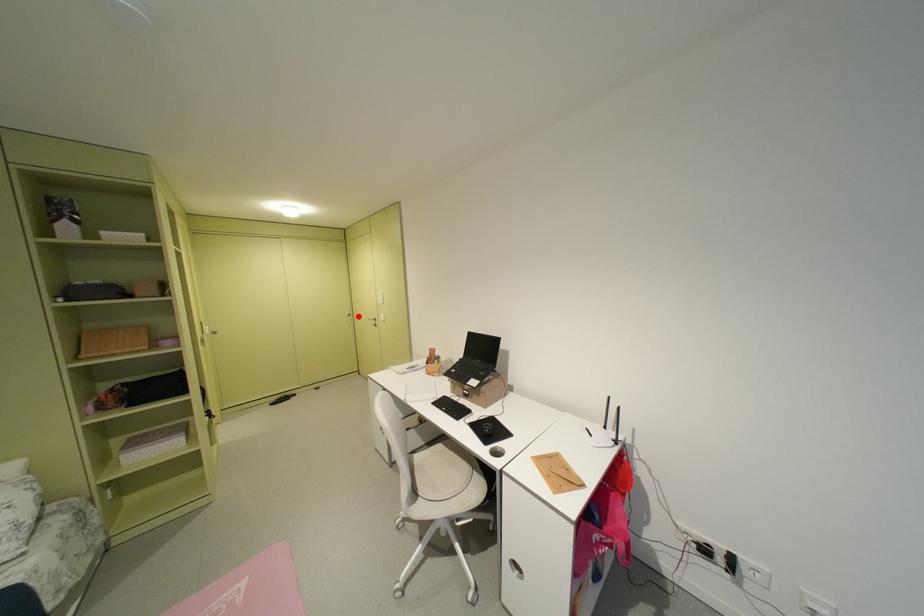
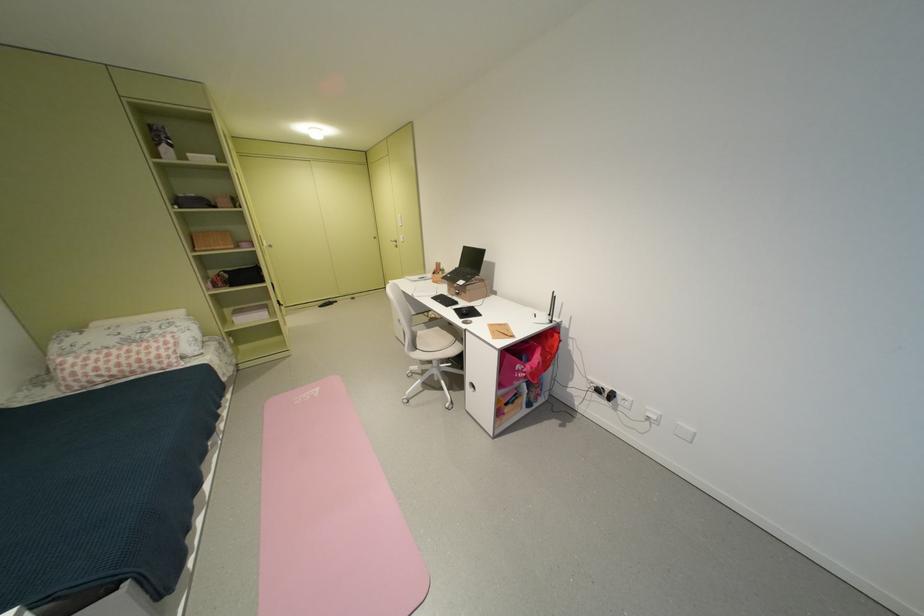
Question: I am providing you with two images of the same scene from different viewpoints. In image1, a red point is highlighted. Considering the same 3D point in image2, which of the following is correct?

Choices:
 (A) It is closer
 (B) It is farther

Answer: (A)